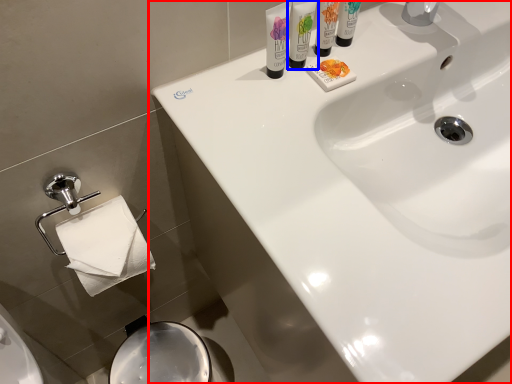
Question: Among these objects, which one is farthest to the camera, sink (highlighted by a red box) or shaving cream (highlighted by a blue box)?

Choices:
 (A) sink
 (B) shaving cream

Answer: (B)